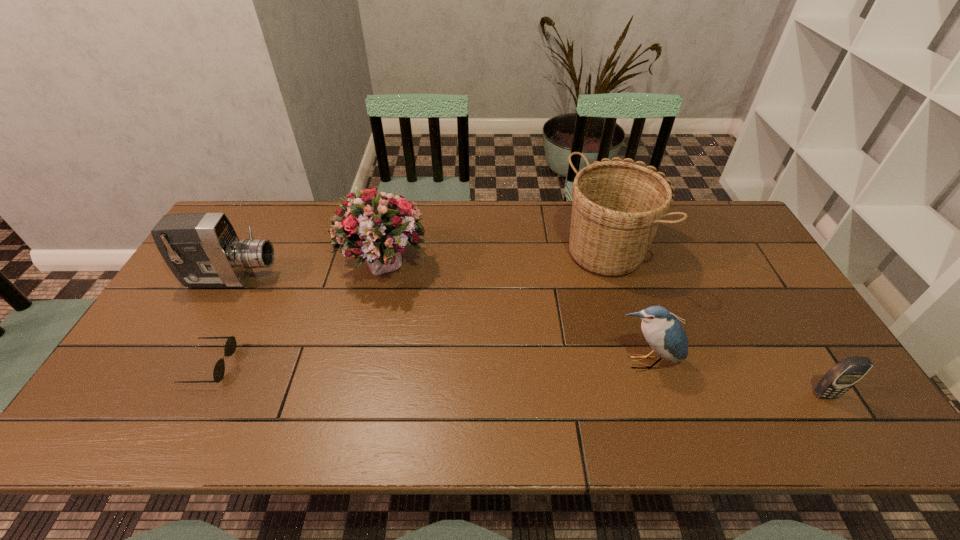
Identify the location of free location located at the tip of the bird's beak. The height and width of the screenshot is (540, 960). (658, 405).

The image size is (960, 540). Identify the location of vacant area situated 0.070m on the front face of the nearest object. (846, 429).

You are a GUI agent. You are given a task and a screenshot of the screen. Output one action in this format:
    pyautogui.click(x=<x>, y=<y>)
    Task: Click on the vacant space located 0.330m on the front-facing side of the sunglasses
    
    Given the screenshot: What is the action you would take?
    pyautogui.click(x=363, y=365)

The height and width of the screenshot is (540, 960). I want to click on basket that is at the far edge, so click(617, 207).

You are a GUI agent. You are given a task and a screenshot of the screen. Output one action in this format:
    pyautogui.click(x=<x>, y=<y>)
    Task: Click on the bouquet positioned at the far edge
    The width and height of the screenshot is (960, 540).
    Given the screenshot: What is the action you would take?
    pyautogui.click(x=377, y=226)

I want to click on camcorder that is at the left edge, so click(202, 250).

What are the coordinates of `sunglasses that is at the left edge` in the screenshot? It's located at (230, 346).

The image size is (960, 540). In order to click on object that is positioned at the right edge in this screenshot , I will do `click(848, 371)`.

Locate an element on the screen. This screenshot has height=540, width=960. vacant space at the far edge is located at coordinates click(x=301, y=217).

Identify the location of vacant space at the near edge. The width and height of the screenshot is (960, 540). (602, 407).